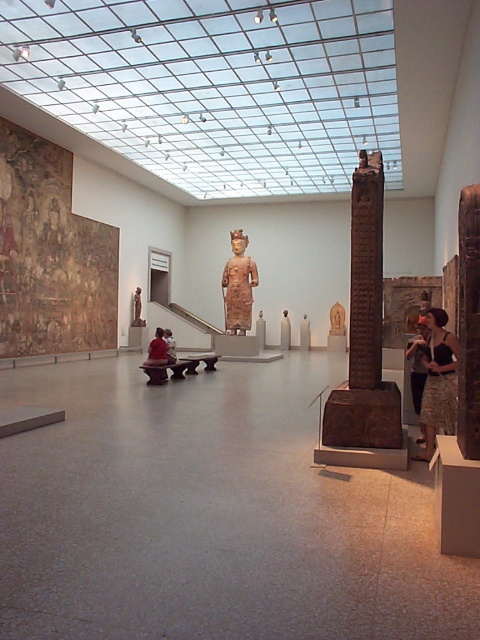
Can you confirm if black textured skirt at lower right is bigger than matte brown statue at center?

No.

Between black textured skirt at lower right and matte brown statue at center, which one appears on the left side from the viewer's perspective?

matte brown statue at center is more to the left.

Does point (442, 388) lie behind point (241, 276)?

No, (442, 388) is in front of (241, 276).

I want to click on black textured skirt at lower right, so click(439, 381).

Between black textured skirt at lower right and matte black statue at center, which one appears on the right side from the viewer's perspective?

Positioned to the right is matte black statue at center.

Can you confirm if black textured skirt at lower right is positioned below matte black statue at center?

Yes.

What do you see at coordinates (439, 381) in the screenshot? Image resolution: width=480 pixels, height=640 pixels. I see `black textured skirt at lower right` at bounding box center [439, 381].

The width and height of the screenshot is (480, 640). I want to click on black textured skirt at lower right, so click(439, 381).

Who is taller, matte brown statue at center or matte black statue at center?

With more height is matte brown statue at center.

Is point (228, 260) behind point (420, 396)?

Yes, point (228, 260) is farther from viewer.

Locate an element on the screen. matte brown statue at center is located at coordinates (239, 285).